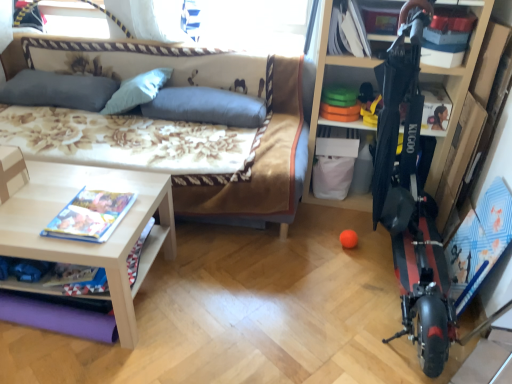
Question: Is light wood/texture table at lower left spatially inside gray fabric pillow at upper left, marked as the first pillow in a left-to-right arrangement, or outside of it?

Choices:
 (A) inside
 (B) outside

Answer: (B)

Question: Is light wood/texture table at lower left in front of or behind gray fabric pillow at upper left, marked as the third pillow in a right-to-left arrangement, in the image?

Choices:
 (A) behind
 (B) front

Answer: (B)

Question: Considering the real-world distances, which object is farthest from the orange matte ball at center?

Choices:
 (A) floral fabric studio couch at center
 (B) light wood/texture table at lower left
 (C) blue fabric pillow at center, the 1th pillow from the right
 (D) gray fabric pillow at upper left, marked as the first pillow in a left-to-right arrangement
 (E) hardcover book at lower left, positioned as the second book in right-to-left order

Answer: (D)

Question: Considering the real-world distances, which object is closest to the wooden shelf at right?

Choices:
 (A) orange matte ball at center
 (B) gray fabric pillow at upper left, marked as the third pillow in a right-to-left arrangement
 (C) hardcover book at lower left, arranged as the 1th book when ordered from the bottom
 (D) blue fabric pillow at center, the 1th pillow from the right
 (E) white paper book at upper right, placed as the 2th book when sorted from bottom to top

Answer: (E)